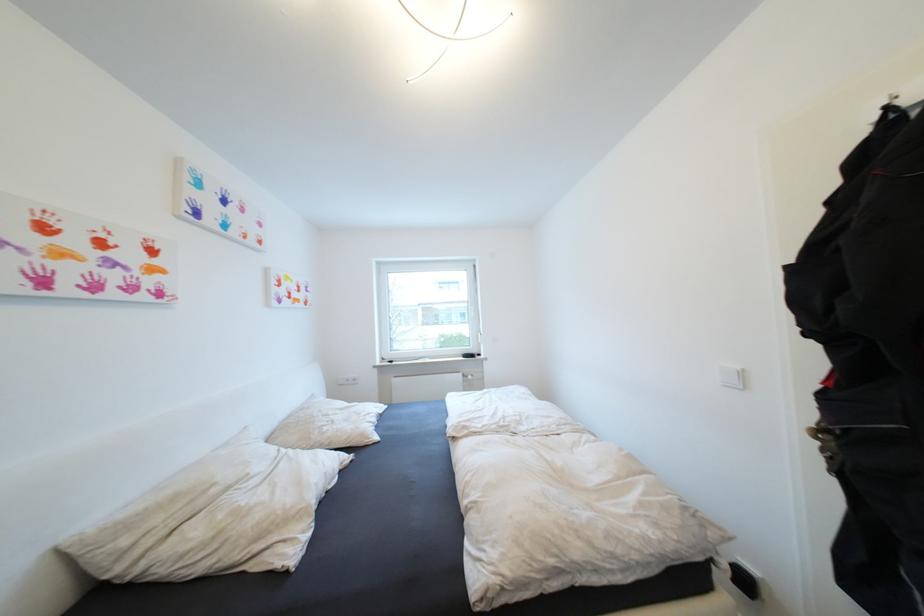
What do you see at coordinates (475, 334) in the screenshot? This screenshot has height=616, width=924. I see `the window handle` at bounding box center [475, 334].